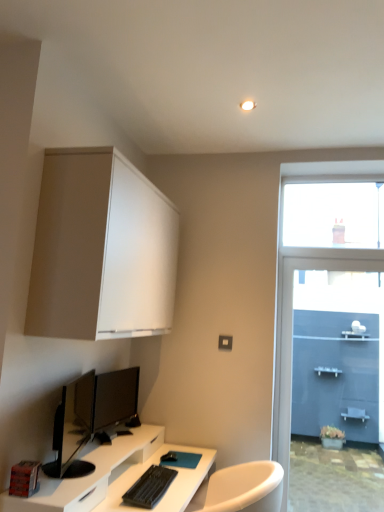
Question: Should I look upward or downward to see black glossy monitor at lower left, placed as the first computer monitor when sorted from front to back?

Choices:
 (A) down
 (B) up

Answer: (A)

Question: Does transparent glass window at upper right appear on the right side of black glossy monitor at center, which appears as the second computer monitor when viewed from the front?

Choices:
 (A) yes
 (B) no

Answer: (A)

Question: Does transparent glass window at upper right turn towards black glossy monitor at center, which appears as the second computer monitor when viewed from the front?

Choices:
 (A) yes
 (B) no

Answer: (B)

Question: From a real-world perspective, is transparent glass window at upper right beneath black glossy monitor at center, the 1th computer monitor when ordered from back to front?

Choices:
 (A) yes
 (B) no

Answer: (B)

Question: Is transparent glass window at upper right touching black glossy monitor at center, which appears as the second computer monitor when viewed from the front?

Choices:
 (A) yes
 (B) no

Answer: (B)

Question: Does transparent glass window at upper right contain black glossy monitor at center, which appears as the second computer monitor when viewed from the front?

Choices:
 (A) yes
 (B) no

Answer: (B)

Question: Is transparent glass window at upper right looking in the opposite direction of black glossy monitor at center, which appears as the second computer monitor when viewed from the front?

Choices:
 (A) yes
 (B) no

Answer: (B)

Question: Is black matte keyboard at lower center thinner than white glossy desk at lower left?

Choices:
 (A) no
 (B) yes

Answer: (B)

Question: Can you confirm if black matte keyboard at lower center is smaller than white glossy desk at lower left?

Choices:
 (A) no
 (B) yes

Answer: (B)

Question: Is black matte keyboard at lower center facing away from white glossy desk at lower left?

Choices:
 (A) yes
 (B) no

Answer: (A)

Question: Is black matte keyboard at lower center not close to white glossy desk at lower left?

Choices:
 (A) no
 (B) yes

Answer: (A)

Question: Can you confirm if black matte keyboard at lower center is shorter than white glossy desk at lower left?

Choices:
 (A) no
 (B) yes

Answer: (B)

Question: Can you confirm if black matte keyboard at lower center is wider than white glossy desk at lower left?

Choices:
 (A) no
 (B) yes

Answer: (A)

Question: Does transparent glass window at upper right have a smaller size compared to black glossy monitor at lower left, placed as the first computer monitor when sorted from front to back?

Choices:
 (A) yes
 (B) no

Answer: (A)